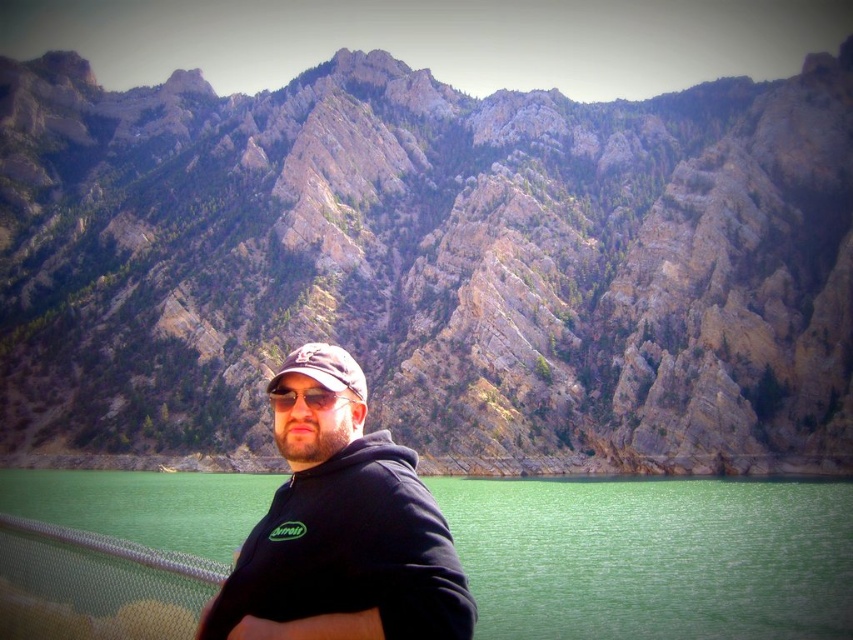
Question: Does black matte hoodie at center lie behind matte black baseball cap at center?

Choices:
 (A) yes
 (B) no

Answer: (B)

Question: Which point is farther to the camera?

Choices:
 (A) black matte hoodie at center
 (B) green smooth water at center
 (C) matte black baseball cap at center
 (D) rocky gray mountain at center

Answer: (D)

Question: Can you confirm if green smooth water at center is smaller than black matte hoodie at center?

Choices:
 (A) yes
 (B) no

Answer: (B)

Question: Considering the real-world distances, which object is farthest from the green smooth water at center?

Choices:
 (A) black matte hoodie at center
 (B) matte black baseball cap at center
 (C) rocky gray mountain at center
 (D) matte black sunglasses at center

Answer: (C)

Question: Among these points, which one is nearest to the camera?

Choices:
 (A) (460, 138)
 (B) (347, 552)

Answer: (B)

Question: Is black matte hoodie at center wider than matte black sunglasses at center?

Choices:
 (A) no
 (B) yes

Answer: (B)